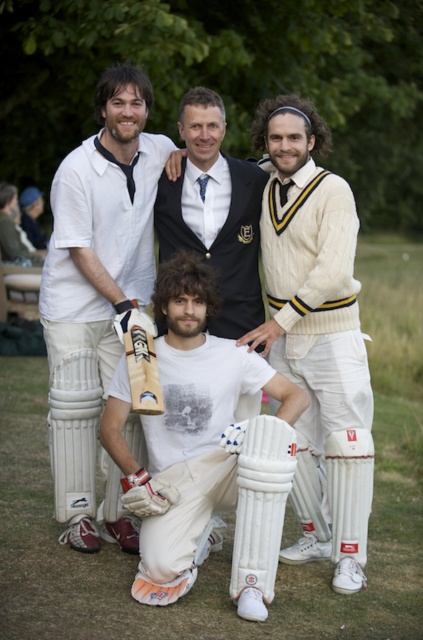
You are a cricket player preparing to hit the ball. You see two cricket bats in front of you, the white leather cricket bat at center and the white textured cricket bat at center. Which bat is closer to the ground?

The white leather cricket bat at center is positioned under the white textured cricket bat at center, so the white leather cricket bat at center is closer to the ground.